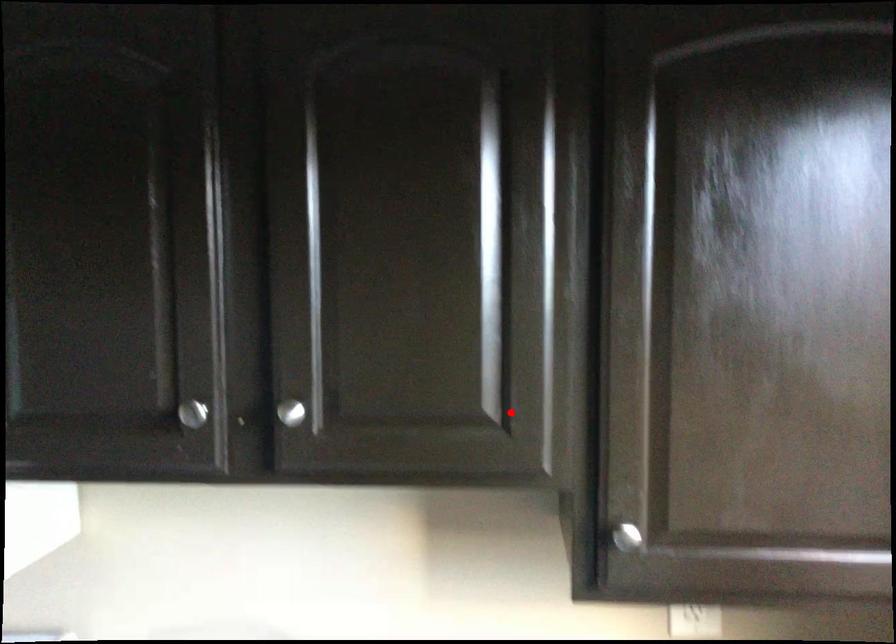
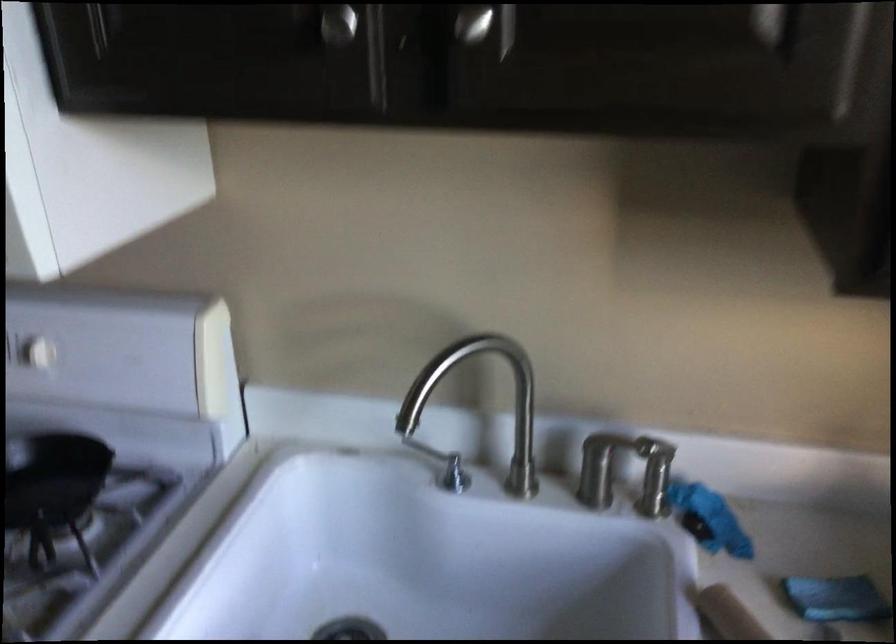
Question: I am providing you with two images of the same scene from different viewpoints. Given a red point in image1, look at the same physical point in image2. Is it:

Choices:
 (A) Closer to the viewpoint
 (B) Farther from the viewpoint

Answer: (A)